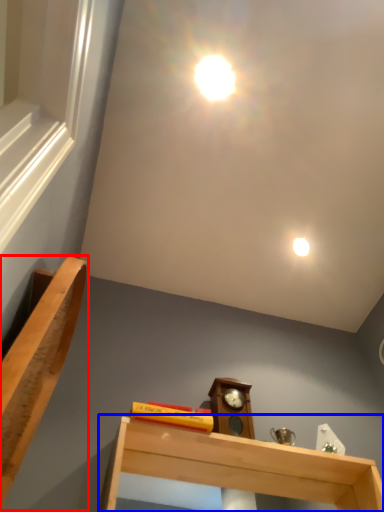
Question: Which point is further to the camera, furniture (highlighted by a red box) or shelf (highlighted by a blue box)?

Choices:
 (A) furniture
 (B) shelf

Answer: (B)